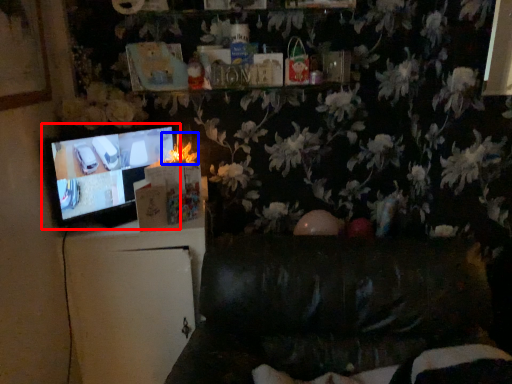
Question: Which point is closer to the camera, television (highlighted by a red box) or flower (highlighted by a blue box)?

Choices:
 (A) television
 (B) flower

Answer: (A)